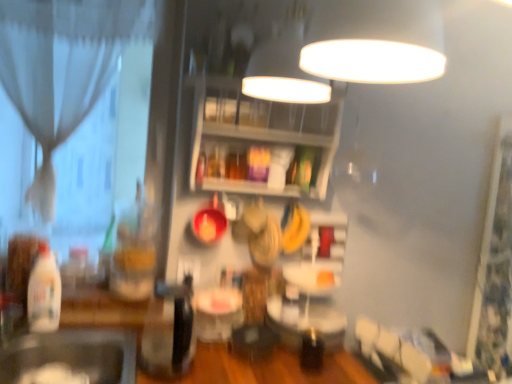
Image resolution: width=512 pixels, height=384 pixels. What do you see at coordinates (63, 67) in the screenshot?
I see `white sheer curtain at left` at bounding box center [63, 67].

You are a GUI agent. You are given a task and a screenshot of the screen. Output one action in this format:
    pyautogui.click(x=<x>, y=<y>)
    Task: Click on the wooden shelves at upper center
    
    Given the screenshot: What is the action you would take?
    pyautogui.click(x=261, y=133)

Considering the positions of objects translucent plastic bottle at left, acting as the 1th bottle starting from the left, and white glossy table at center in the image provided, who is more to the right, translucent plastic bottle at left, acting as the 1th bottle starting from the left, or white glossy table at center?

Positioned to the right is white glossy table at center.

Which of these two, translucent plastic bottle at left, acting as the 2th bottle starting from the back, or white glossy table at center, is smaller?

translucent plastic bottle at left, acting as the 2th bottle starting from the back.

Looking at this image, from a real-world perspective, which object rests below the other?

From a 3D spatial view, white glossy table at center is below.

Are translucent plastic bottle at left, acting as the 1th bottle starting from the left, and white glossy table at center far apart?

No, translucent plastic bottle at left, acting as the 1th bottle starting from the left, is in close proximity to white glossy table at center.

In order to click on food in front of the translucent glass jar at center, which is counted as the second bottle, starting from the left in this screenshot , I will do `click(53, 375)`.

Is white matte plate at lower left not inside translucent glass jar at center, which is the second bottle from front to back?

Yes, white matte plate at lower left is not within translucent glass jar at center, which is the second bottle from front to back.

How many degrees apart are the facing directions of white matte plate at lower left and translucent glass jar at center, marked as the 1th bottle in a back-to-front arrangement?

2.15 degrees separate the facing orientations of white matte plate at lower left and translucent glass jar at center, marked as the 1th bottle in a back-to-front arrangement.

Who is smaller, white matte plate at lower left or translucent glass jar at center, which is counted as the second bottle, starting from the left?

With smaller size is white matte plate at lower left.

From the image's perspective, which is above, translucent plastic bottle at left, the 1th bottle from the front, or white matte plate at lower left?

From the image's view, translucent plastic bottle at left, the 1th bottle from the front, is above.

Is translucent plastic bottle at left, the 1th bottle from the front, not close to white matte plate at lower left?

No, translucent plastic bottle at left, the 1th bottle from the front, is not far from white matte plate at lower left.

Choose the correct answer: Is translucent plastic bottle at left, the second bottle from the right, inside white matte plate at lower left or outside it?

translucent plastic bottle at left, the second bottle from the right, lies outside white matte plate at lower left.

From their relative heights in the image, would you say translucent plastic bottle at left, acting as the 2th bottle starting from the back, is taller or shorter than white matte plate at lower left?

Considering their sizes, translucent plastic bottle at left, acting as the 2th bottle starting from the back, has more height than white matte plate at lower left.

Locate an element on the screen. shelf positioned vertically above the translucent plastic bottle at left, acting as the 2th bottle starting from the back (from a real-world perspective) is located at coordinates (261, 133).

Can you confirm if wooden shelves at upper center is wider than translucent plastic bottle at left, acting as the 2th bottle starting from the back?

Yes.

Is wooden shelves at upper center further to the viewer compared to translucent plastic bottle at left, acting as the 1th bottle starting from the left?

That is True.

Is the surface of translucent glass jar at center, marked as the 1th bottle in a back-to-front arrangement, in direct contact with white sheer curtain at left?

translucent glass jar at center, marked as the 1th bottle in a back-to-front arrangement, and white sheer curtain at left are clearly separated.

Between translucent glass jar at center, which is counted as the second bottle, starting from the left, and white sheer curtain at left, which one has more height?

With more height is white sheer curtain at left.

Does translucent glass jar at center, marked as the 1th bottle in a back-to-front arrangement, come in front of white sheer curtain at left?

No, it is not.

Is translucent plastic bottle at left, acting as the 2th bottle starting from the back, completely or partially inside translucent glass jar at center, which is the second bottle from front to back?

That's incorrect, translucent plastic bottle at left, acting as the 2th bottle starting from the back, is not inside translucent glass jar at center, which is the second bottle from front to back.

Identify the location of bottle that appears behind the translucent plastic bottle at left, acting as the 2th bottle starting from the back. The height and width of the screenshot is (384, 512). (135, 252).

Does translucent glass jar at center, marked as the 1th bottle in a back-to-front arrangement, turn towards translucent plastic bottle at left, the second bottle from the right?

No, translucent glass jar at center, marked as the 1th bottle in a back-to-front arrangement, is not aimed at translucent plastic bottle at left, the second bottle from the right.

In the image, is white glossy table at center positioned in front of or behind black matte sink at lower left?

Clearly, white glossy table at center is behind black matte sink at lower left.

From the picture: Could black matte sink at lower left be considered to be inside white glossy table at center?

No, black matte sink at lower left is located outside of white glossy table at center.

Does point (204, 314) appear closer or farther from the camera than point (73, 368)?

Point (204, 314) is positioned farther from the camera compared to point (73, 368).

Which of these two, white glossy table at center or black matte sink at lower left, is bigger?

Bigger between the two is black matte sink at lower left.

The width and height of the screenshot is (512, 384). What are the coordinates of `the 2nd bottle counting from the left of the white glossy table at center` in the screenshot? It's located at (44, 293).

There is a white matte plate at lower left. Identify the location of the 2nd bottle above it (from a real-world perspective). (135, 252).

Based on their spatial positions, is black matte sink at lower left or wooden shelves at upper center closer to translucent glass jar at center, which is the first bottle in right-to-left order?

Based on the image, black matte sink at lower left appears to be nearer to translucent glass jar at center, which is the first bottle in right-to-left order.

From the image, which object appears to be nearer to white sheer curtain at left, black matte sink at lower left or white glossy table at center?

black matte sink at lower left is positioned closer to the anchor white sheer curtain at left.

Based on their spatial positions, is white glossy table at center or translucent glass jar at center, which is counted as the second bottle, starting from the left, closer to black matte sink at lower left?

Among the two, translucent glass jar at center, which is counted as the second bottle, starting from the left, is located nearer to black matte sink at lower left.

When comparing their distances from white matte plate at lower left, does translucent glass jar at center, which is counted as the second bottle, starting from the left, or wooden shelves at upper center seem closer?

translucent glass jar at center, which is counted as the second bottle, starting from the left.

Based on the photo, looking at the image, which one is located further to translucent plastic bottle at left, acting as the 1th bottle starting from the left, black matte sink at lower left or white sheer curtain at left?

white sheer curtain at left is further to translucent plastic bottle at left, acting as the 1th bottle starting from the left.

Looking at the image, which one is located closer to white glossy table at center, white sheer curtain at left or translucent glass jar at center, which is the second bottle from front to back?

translucent glass jar at center, which is the second bottle from front to back, is positioned closer to the anchor white glossy table at center.

Looking at the image, which one is located further to white matte plate at lower left, white sheer curtain at left or translucent glass jar at center, which is the second bottle from front to back?

white sheer curtain at left is positioned further to the anchor white matte plate at lower left.

When comparing their distances from white glossy table at center, does black matte sink at lower left or white sheer curtain at left seem further?

white sheer curtain at left is further to white glossy table at center.

Where is `bottle between black matte sink at lower left and white glossy table at center from left to right`? The height and width of the screenshot is (384, 512). bottle between black matte sink at lower left and white glossy table at center from left to right is located at coordinates (135, 252).

Locate an element on the screen. food situated between translucent plastic bottle at left, acting as the 2th bottle starting from the back, and wooden shelves at upper center from left to right is located at coordinates [53, 375].

Find the location of `table between wooden shelves at upper center and black matte sink at lower left vertically`. table between wooden shelves at upper center and black matte sink at lower left vertically is located at coordinates (217, 313).

This screenshot has height=384, width=512. I want to click on shelf between white sheer curtain at left and white matte plate at lower left from top to bottom, so click(x=261, y=133).